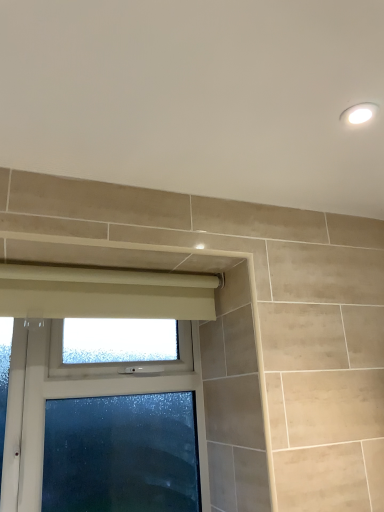
Question: Would you consider white glossy light fixture at upper right to be distant from beige fabric curtain at upper center?

Choices:
 (A) no
 (B) yes

Answer: (A)

Question: Could you tell me if white glossy light fixture at upper right is turned towards beige fabric curtain at upper center?

Choices:
 (A) yes
 (B) no

Answer: (B)

Question: From a real-world perspective, is white glossy light fixture at upper right physically below beige fabric curtain at upper center?

Choices:
 (A) no
 (B) yes

Answer: (A)

Question: Is the position of white glossy light fixture at upper right less distant than that of beige fabric curtain at upper center?

Choices:
 (A) no
 (B) yes

Answer: (B)

Question: Is white glossy light fixture at upper right smaller than beige fabric curtain at upper center?

Choices:
 (A) yes
 (B) no

Answer: (A)

Question: From their relative heights in the image, would you say beige fabric curtain at upper center is taller or shorter than frosted glass window at lower left?

Choices:
 (A) short
 (B) tall

Answer: (A)

Question: Looking at their shapes, would you say beige fabric curtain at upper center is wider or thinner than frosted glass window at lower left?

Choices:
 (A) wide
 (B) thin

Answer: (B)

Question: Is point (180, 309) closer or farther from the camera than point (198, 423)?

Choices:
 (A) closer
 (B) farther

Answer: (A)

Question: From the image's perspective, is beige fabric curtain at upper center above or below frosted glass window at lower left?

Choices:
 (A) below
 (B) above

Answer: (B)

Question: Is frosted glass window at lower left bigger or smaller than white glossy light fixture at upper right?

Choices:
 (A) small
 (B) big

Answer: (B)

Question: In the image, is frosted glass window at lower left on the left side or the right side of white glossy light fixture at upper right?

Choices:
 (A) left
 (B) right

Answer: (A)

Question: Considering the positions of point (175, 352) and point (367, 105), is point (175, 352) closer or farther from the camera than point (367, 105)?

Choices:
 (A) closer
 (B) farther

Answer: (B)

Question: From a real-world perspective, is frosted glass window at lower left positioned above or below white glossy light fixture at upper right?

Choices:
 (A) above
 (B) below

Answer: (B)

Question: Is white glossy light fixture at upper right wider or thinner than frosted glass window at lower left?

Choices:
 (A) thin
 (B) wide

Answer: (A)

Question: From the image's perspective, is white glossy light fixture at upper right positioned above or below frosted glass window at lower left?

Choices:
 (A) below
 (B) above

Answer: (B)